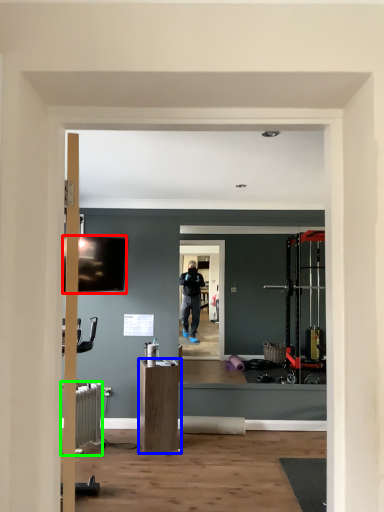
Question: Considering the real-world distances, which object is farthest from television (highlighted by a red box)? furniture (highlighted by a blue box) or radiator (highlighted by a green box)?

Choices:
 (A) furniture
 (B) radiator

Answer: (A)